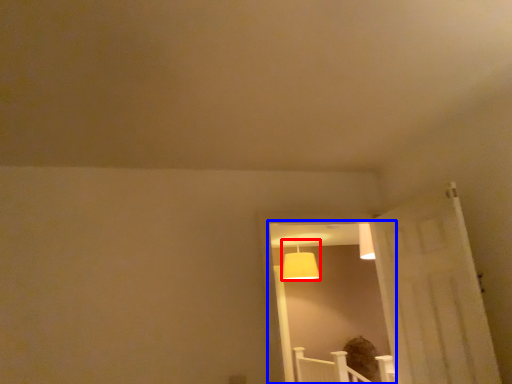
Question: Which point is closer to the camera, lamp (highlighted by a red box) or window (highlighted by a blue box)?

Choices:
 (A) lamp
 (B) window

Answer: (B)